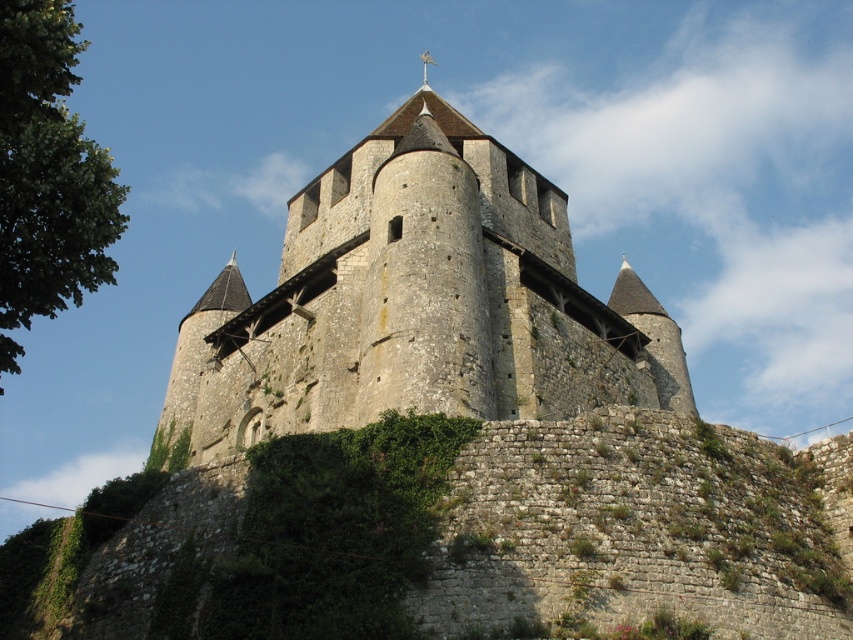
Describe the element at coordinates (453, 538) in the screenshot. I see `green mossy stone wall at center` at that location.

Between point (648, 490) and point (677, 328), which one is positioned in front?

Point (648, 490) is in front.

What are the coordinates of `green mossy stone wall at center` in the screenshot? It's located at (453, 538).